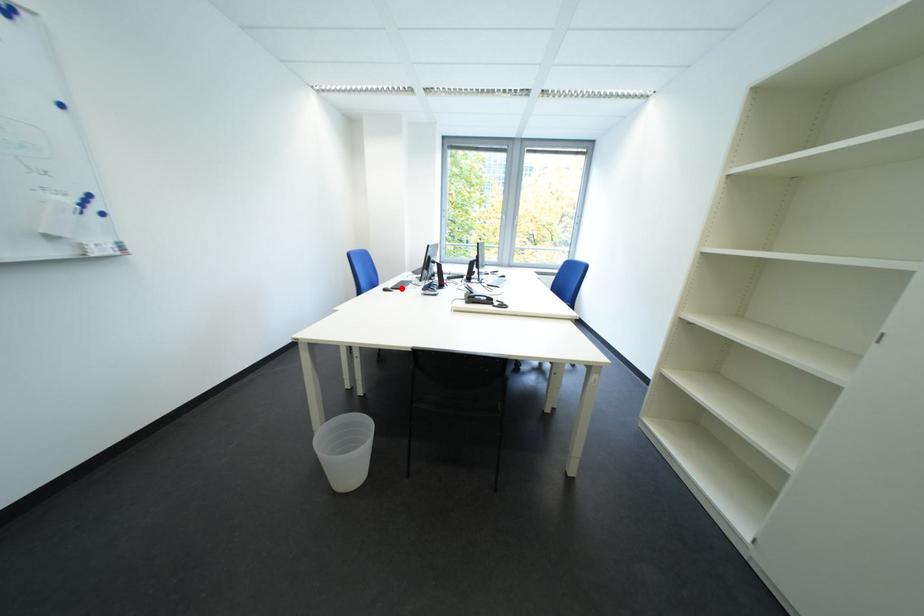
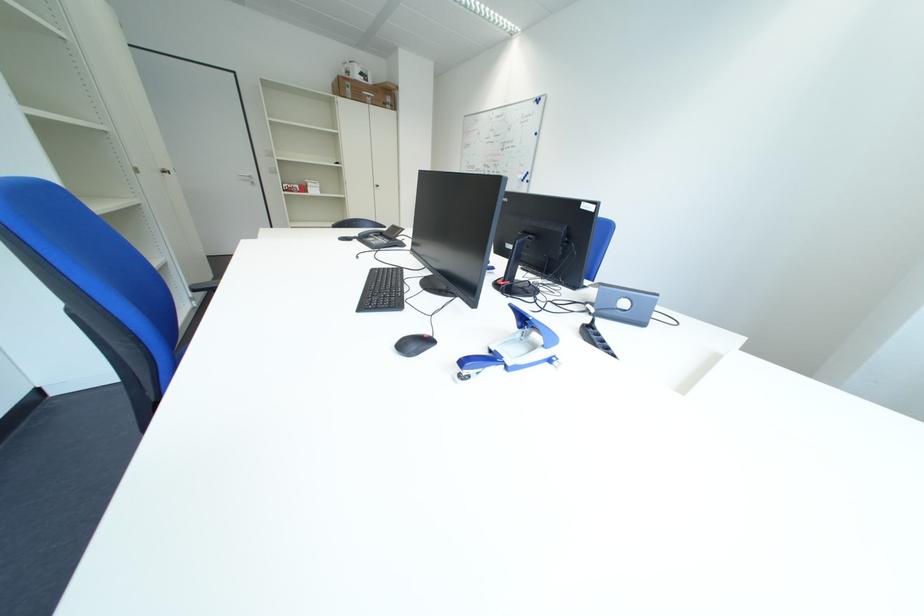
Question: I am providing you with two images of the same scene from different viewpoints. A red point is marked on the first image. Can you still see the location of the red point in image 2?

Choices:
 (A) Yes
 (B) No

Answer: (B)